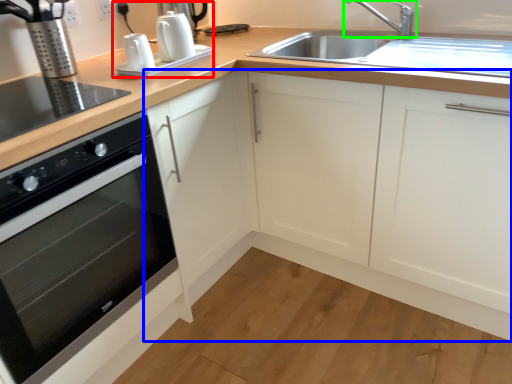
Question: Which is nearer to the coffee machine (highlighted by a red box)? cabinetry (highlighted by a blue box) or tap (highlighted by a green box).

Choices:
 (A) cabinetry
 (B) tap

Answer: (A)